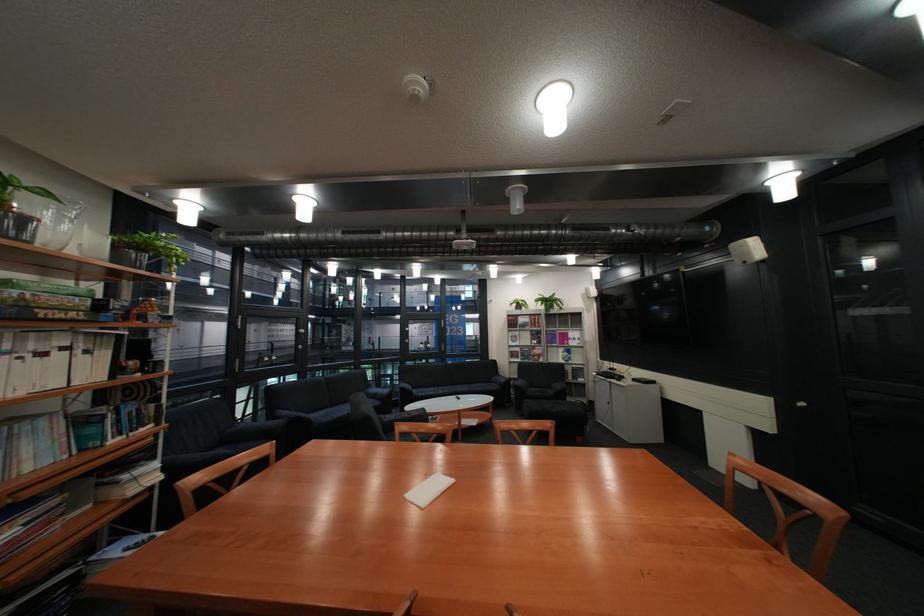
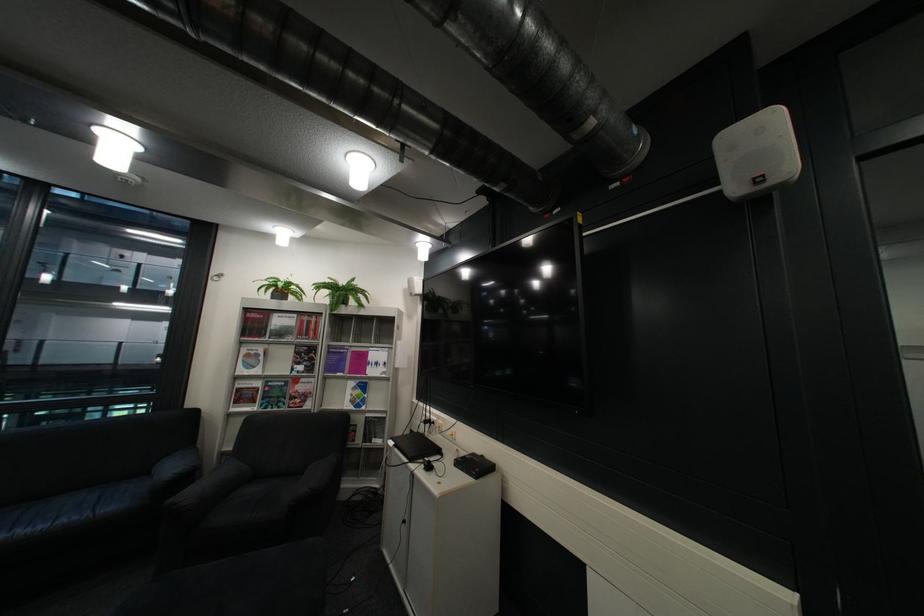
Where in the second image is the point corresponding to pixel 596 379 from the first image?

(393, 442)